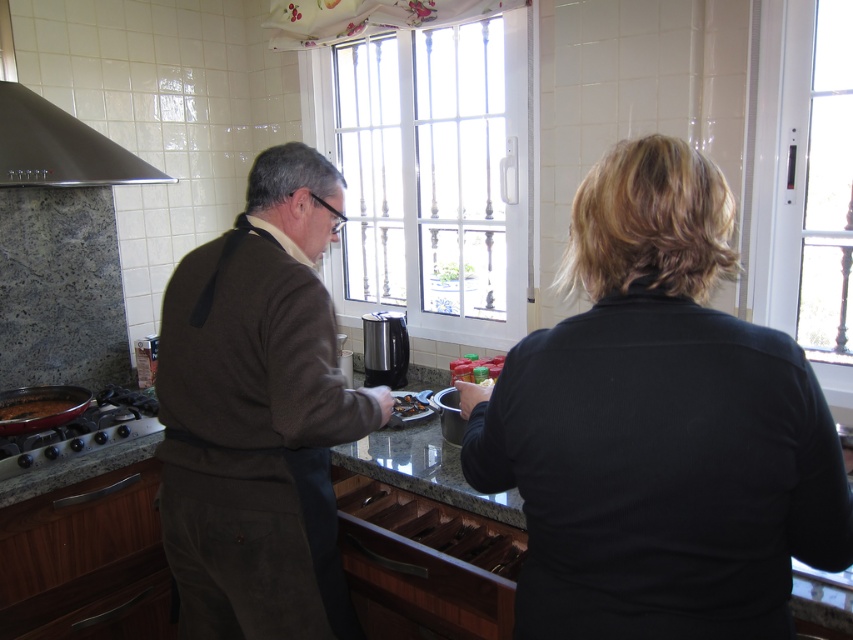
Question: Among these points, which one is farthest from the camera?

Choices:
 (A) (402, 476)
 (B) (397, 412)
 (C) (161, 177)

Answer: (B)

Question: Can you confirm if brown corduroy sweater at center is positioned to the right of satin silver exhaust hood at upper left?

Choices:
 (A) yes
 (B) no

Answer: (A)

Question: Which point is closer to the camera?

Choices:
 (A) brown corduroy sweater at center
 (B) black matte shirt at center

Answer: (B)

Question: Does brown corduroy sweater at center have a lesser width compared to satin silver exhaust hood at upper left?

Choices:
 (A) yes
 (B) no

Answer: (A)

Question: Is granite countertop at center wider than shiny metallic food at center?

Choices:
 (A) no
 (B) yes

Answer: (B)

Question: Which object is farther from the camera taking this photo?

Choices:
 (A) shiny metallic food at center
 (B) black matte shirt at center

Answer: (A)